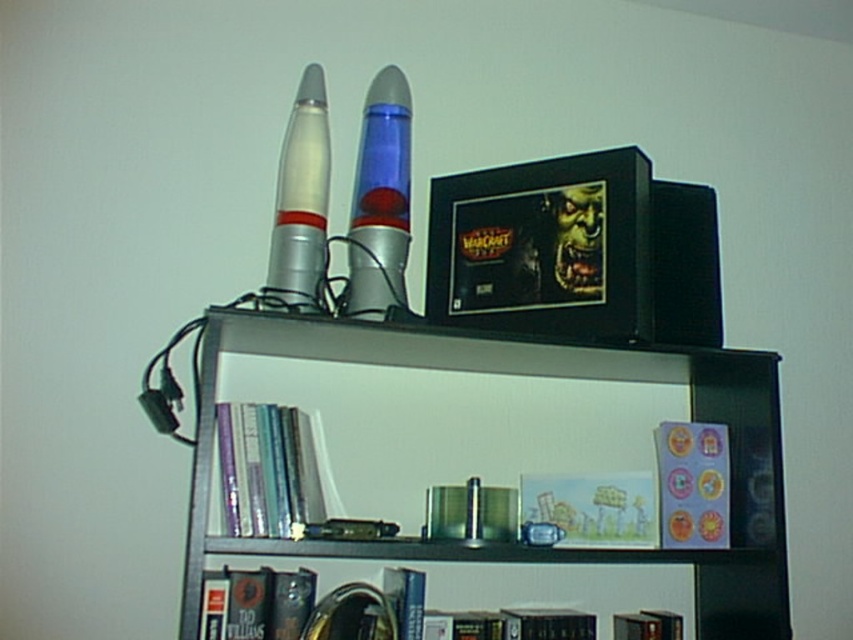
Question: Which of the following is the farthest from the observer?

Choices:
 (A) (393, 257)
 (B) (431, 188)
 (C) (688, 465)
 (D) (281, 602)

Answer: (B)

Question: Where is translucent blue liquid at upper center located in relation to hardcover book at lower left in the image?

Choices:
 (A) below
 (B) above

Answer: (B)

Question: Among these objects, which one is nearest to the camera?

Choices:
 (A) metallic silver coaster at lower right
 (B) hardcover book at lower center
 (C) metallic black picture frame at upper center

Answer: (C)

Question: Where is metallic black picture frame at upper center located in relation to metallic silver coaster at lower right in the image?

Choices:
 (A) below
 (B) above

Answer: (B)

Question: Which is farther from the metallic black picture frame at upper center?

Choices:
 (A) hardcover book at lower center
 (B) hardcover book at center

Answer: (A)

Question: Can you confirm if silver metallic rocket at upper left is positioned to the right of hardcover book at lower left?

Choices:
 (A) no
 (B) yes

Answer: (B)